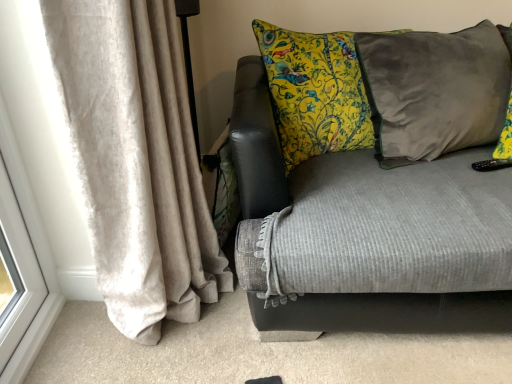
Locate an element on the screen. The image size is (512, 384). vacant area that is in front of beige velvet curtain at left is located at coordinates (152, 365).